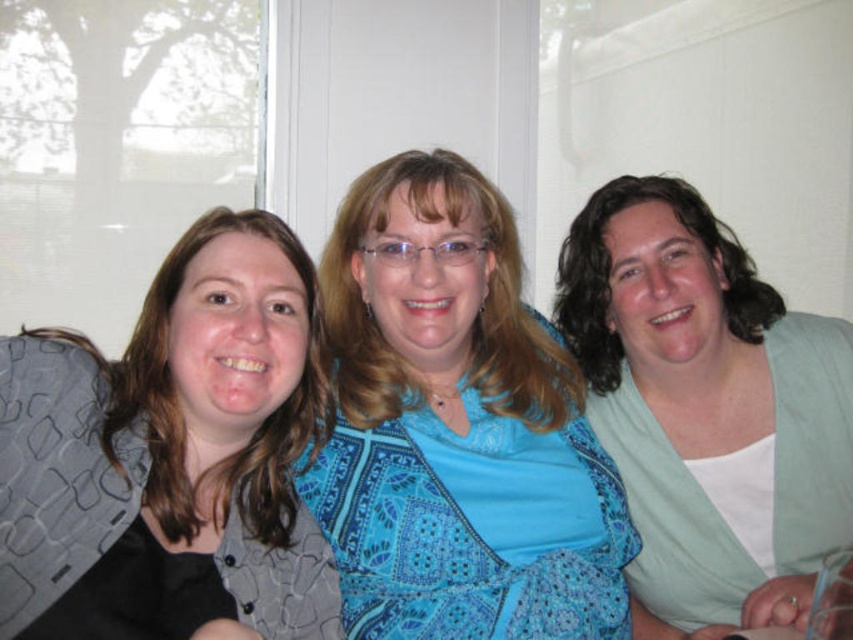
Question: Which is farther from the white matte shirt at right?

Choices:
 (A) matte gray vest at left
 (B) blue paisley dress at center

Answer: (A)

Question: Which point is farther from the camera taking this photo?

Choices:
 (A) (548, 568)
 (B) (15, 403)

Answer: (A)

Question: Which of the following is the closest to the observer?

Choices:
 (A) matte gray vest at left
 (B) white matte shirt at right
 (C) blue paisley dress at center

Answer: (A)

Question: Can you confirm if matte gray vest at left is thinner than white matte shirt at right?

Choices:
 (A) yes
 (B) no

Answer: (A)

Question: Can you confirm if blue paisley dress at center is positioned below white matte shirt at right?

Choices:
 (A) yes
 (B) no

Answer: (A)

Question: Does matte gray vest at left have a smaller size compared to white matte shirt at right?

Choices:
 (A) yes
 (B) no

Answer: (A)